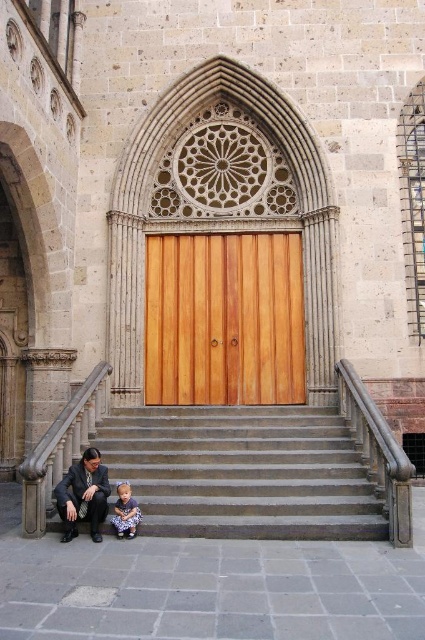
Question: Does gray stone stairs at lower center come behind dark gray suit at lower left?

Choices:
 (A) yes
 (B) no

Answer: (A)

Question: Which of the following is the closest to the observer?

Choices:
 (A) (252, 397)
 (B) (76, 499)
 (C) (133, 532)
 (D) (288, 429)

Answer: (C)

Question: Can you confirm if wooden door at center is bigger than matte purple dress at lower left?

Choices:
 (A) yes
 (B) no

Answer: (A)

Question: Is gray stone stairs at lower center above matte purple dress at lower left?

Choices:
 (A) yes
 (B) no

Answer: (A)

Question: Estimate the real-world distances between objects in this image. Which object is closer to the wooden door at center?

Choices:
 (A) dark gray suit at lower left
 (B) matte purple dress at lower left

Answer: (A)

Question: Which object is positioned farthest from the dark gray suit at lower left?

Choices:
 (A) gray stone stairs at lower center
 (B) wooden door at center
 (C) matte purple dress at lower left

Answer: (B)